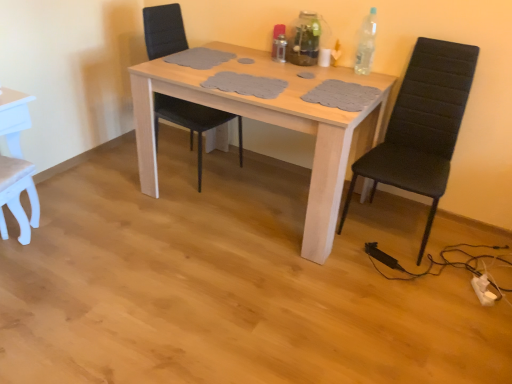
Find the location of a particular element. This screenshot has width=512, height=384. vacant space that is to the left of clear plastic bottle at upper right, the 1th bottle viewed from the right is located at coordinates pos(336,72).